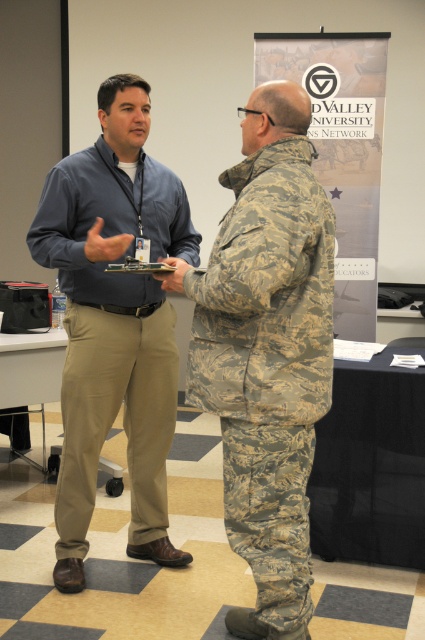
Which is above, camouflage fabric uniform at center or matte blue shirt at center?

Positioned higher is matte blue shirt at center.

Is camouflage fabric uniform at center shorter than matte blue shirt at center?

Correct, camouflage fabric uniform at center is not as tall as matte blue shirt at center.

Who is more distant from viewer, (257, 465) or (146, 314)?

Point (146, 314)

Identify the location of camouflage fabric uniform at center. This screenshot has width=425, height=640. (268, 364).